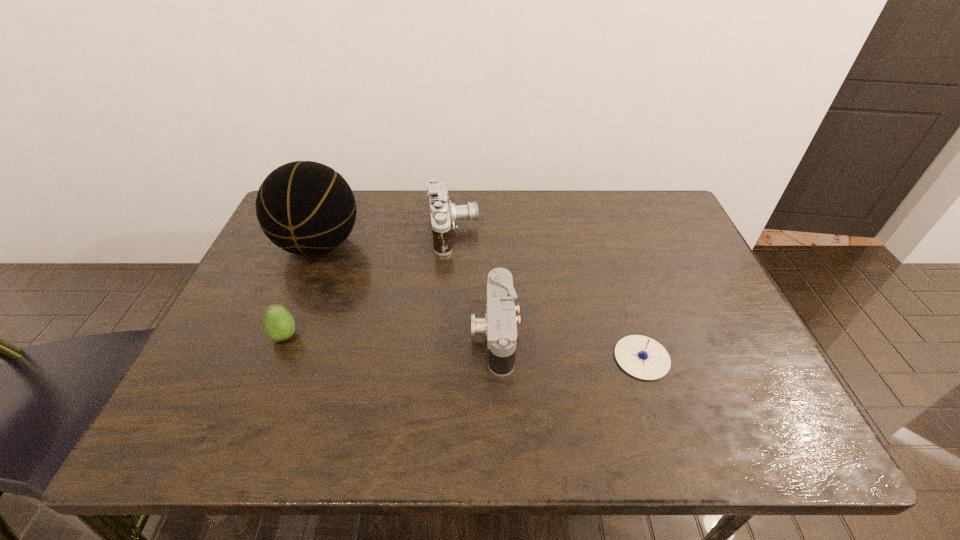
This screenshot has height=540, width=960. What are the coordinates of `blank area at the far right corner` in the screenshot? It's located at (665, 205).

Locate an element on the screen. blank space at the near right corner of the desktop is located at coordinates (806, 449).

Identify the location of free space between the nearer camera and the farther camera. The image size is (960, 540). (474, 282).

What are the coordinates of `vacant region between the avocado and the farther camera` in the screenshot? It's located at (369, 284).

Where is `blank region between the nearer camera and the avocado`? This screenshot has width=960, height=540. blank region between the nearer camera and the avocado is located at coordinates (390, 335).

You are a GUI agent. You are given a task and a screenshot of the screen. Output one action in this format:
    pyautogui.click(x=<x>, y=<y>)
    Task: Click on the vacant area that lies between the tallest object and the rightmost object
    
    Given the screenshot: What is the action you would take?
    pyautogui.click(x=481, y=301)

The height and width of the screenshot is (540, 960). Identify the location of free point between the farther camera and the nearer camera. (474, 282).

Find the location of a particular element. The height and width of the screenshot is (540, 960). unoccupied position between the compass and the nearer camera is located at coordinates (568, 346).

Locate an element on the screen. free space between the avocado and the farther camera is located at coordinates (369, 284).

Image resolution: width=960 pixels, height=540 pixels. In order to click on free area in between the rightmost object and the nearer camera in this screenshot , I will do `click(568, 346)`.